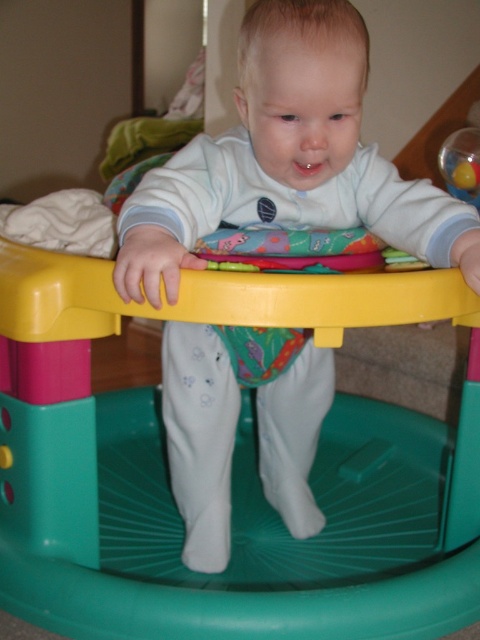
You are a parent trying to place two baby walkers in your living room. The plastic walker at center and the white matte baby walker at center. You want to arrange them so that the plastic walker is to the left of the white matte baby walker. Is the current arrangement already correct?

The plastic walker at center is positioned on the left side of white matte baby walker at center, so yes, the current arrangement already has the plastic walker at center to the left of the white matte baby walker at center.

You are a parent trying to ensure your child stays within a safe area while playing. The activity center has a yellow top rail and green base. You notice a point at coordinates (232,497). What object is located at this point?

The point at coordinates (232,497) corresponds to the plastic walker at center.

What are the coordinates of the plastic walker at center?

The plastic walker at center is located at point (232, 497).